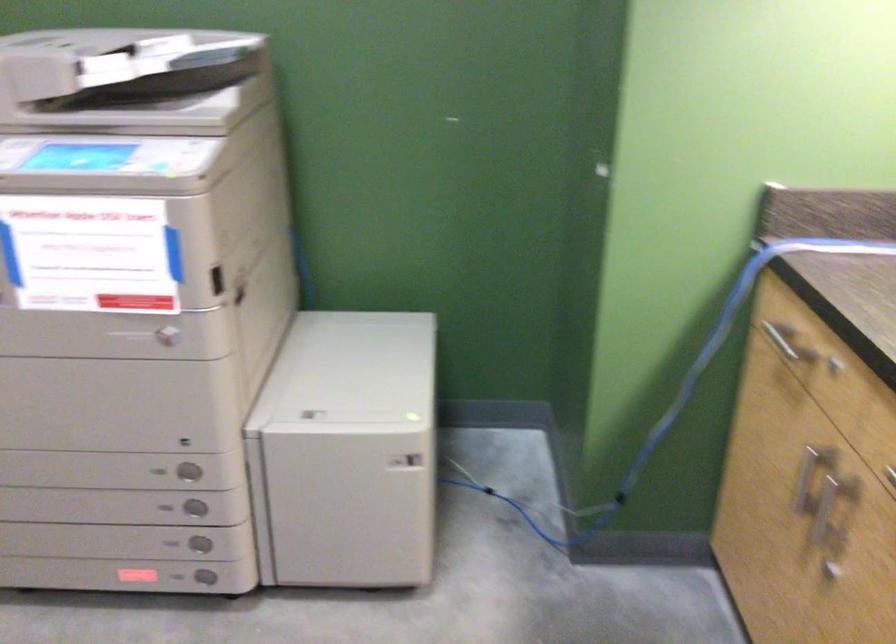
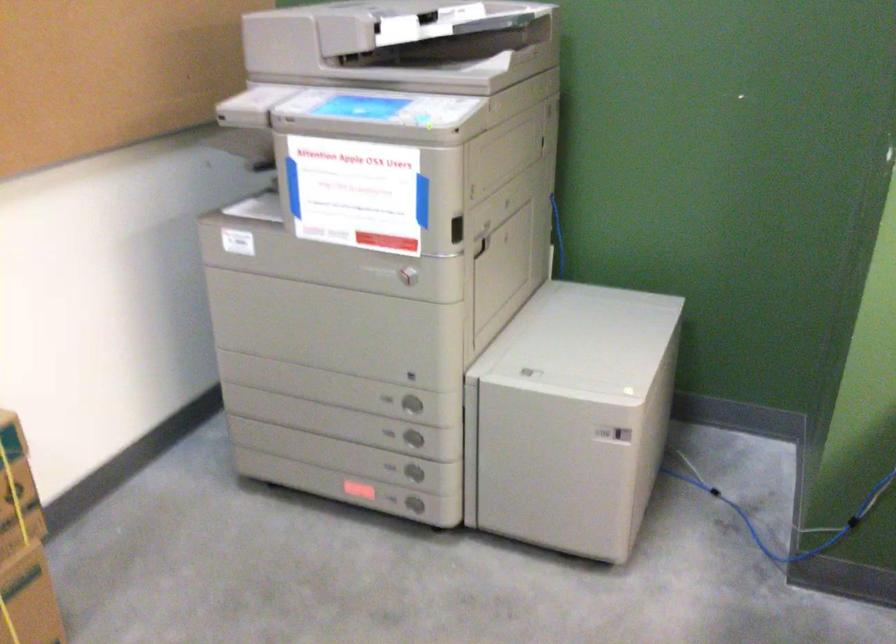
The point at (x=366, y=453) is marked in the first image. Where is the corresponding point in the second image?

(572, 418)